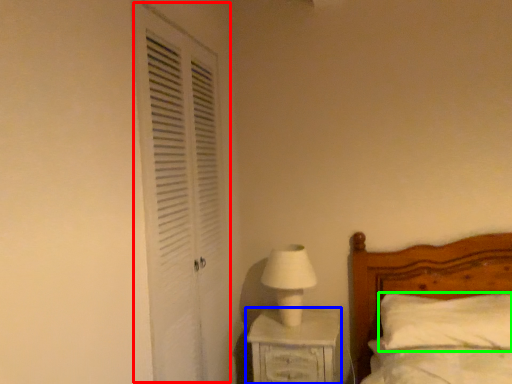
Question: Based on their relative distances, which object is nearer to screen door (highlighted by a red box)? Choose from nightstand (highlighted by a blue box) and pillow (highlighted by a green box).

Choices:
 (A) nightstand
 (B) pillow

Answer: (A)